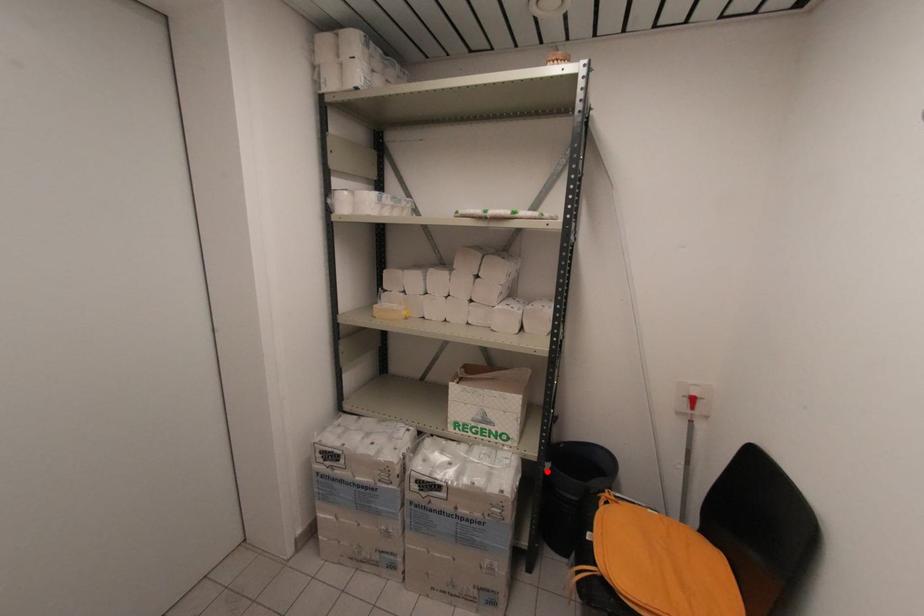
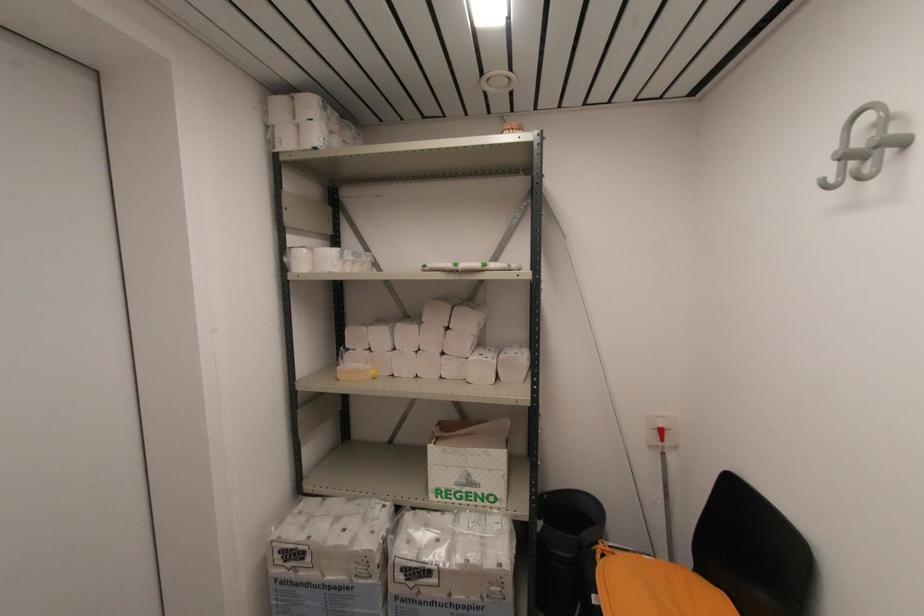
The point at the highlighted location is marked in the first image. Where is the corresponding point in the second image?

(540, 530)